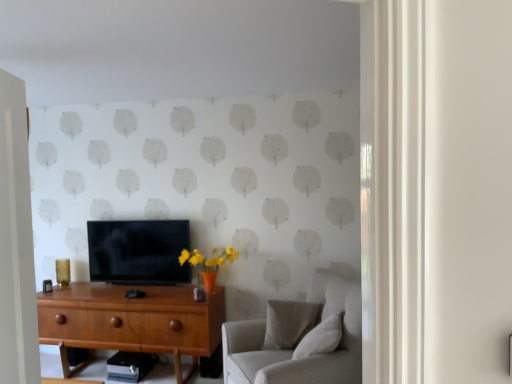
What are the coordinates of `wooden desk at center` in the screenshot? It's located at (133, 322).

I want to click on white textured pillow at lower right, which is the first pillow from front to back, so pyautogui.click(x=321, y=338).

Measure the distance between light gray fabric couch at right and camera.

light gray fabric couch at right and camera are 2.34 meters apart.

The height and width of the screenshot is (384, 512). Describe the element at coordinates (138, 252) in the screenshot. I see `matte black tv at center` at that location.

Describe the element at coordinates (288, 323) in the screenshot. The width and height of the screenshot is (512, 384). I see `light gray fabric pillow at center, positioned as the 1th pillow in back-to-front order` at that location.

Identify the location of wooden desk at center. (133, 322).

From the image's perspective, between white textured pillow at lower right, placed as the second pillow when sorted from back to front, and matte black tv at center, which one is located above?

matte black tv at center.

What's the angular difference between white textured pillow at lower right, placed as the second pillow when sorted from back to front, and matte black tv at center's facing directions?

There is a 99.3-degree angle between the facing directions of white textured pillow at lower right, placed as the second pillow when sorted from back to front, and matte black tv at center.

Based on the photo, is white textured pillow at lower right, which is the first pillow from front to back, bigger than matte black tv at center?

No.

Who is taller, white textured pillow at lower right, placed as the second pillow when sorted from back to front, or matte black tv at center?

matte black tv at center.

Looking at this image, is white textured pillow at lower right, which is the first pillow from front to back, located within matte black tv at center?

Definitely not — white textured pillow at lower right, which is the first pillow from front to back, is not inside matte black tv at center.

Which is in front, matte black tv at center or white textured pillow at lower right, which is the first pillow from front to back?

white textured pillow at lower right, which is the first pillow from front to back, is in front.

Looking at this image, in terms of size, does matte black tv at center appear bigger or smaller than white textured pillow at lower right, which is the first pillow from front to back?

Clearly, matte black tv at center is larger in size than white textured pillow at lower right, which is the first pillow from front to back.

Is matte black tv at center positioned with its back to light gray fabric couch at right?

No, light gray fabric couch at right is not at the back of matte black tv at center.

Is matte black tv at center in front of light gray fabric couch at right?

No, matte black tv at center is further to the viewer.

Can you see matte black tv at center touching light gray fabric couch at right?

There is a gap between matte black tv at center and light gray fabric couch at right.

Looking at this image, between wooden desk at center and white textured pillow at lower right, which is the first pillow from front to back, which one has smaller width?

white textured pillow at lower right, which is the first pillow from front to back.

Considering the sizes of wooden desk at center and white textured pillow at lower right, placed as the second pillow when sorted from back to front, in the image, is wooden desk at center taller or shorter than white textured pillow at lower right, placed as the second pillow when sorted from back to front,?

wooden desk at center is taller than white textured pillow at lower right, placed as the second pillow when sorted from back to front.

Is white textured pillow at lower right, placed as the second pillow when sorted from back to front, located within wooden desk at center?

That's incorrect, white textured pillow at lower right, placed as the second pillow when sorted from back to front, is not inside wooden desk at center.

Which of these two, wooden desk at center or white textured pillow at lower right, which is the first pillow from front to back, is smaller?

white textured pillow at lower right, which is the first pillow from front to back, is smaller.

Based on the photo, which object is more forward, matte black tv at center or light gray fabric pillow at center, arranged as the 2th pillow when viewed from the front?

light gray fabric pillow at center, arranged as the 2th pillow when viewed from the front, is in front.

Is matte black tv at center at the left side of light gray fabric pillow at center, positioned as the 1th pillow in back-to-front order?

Yes.

Does matte black tv at center have a greater height compared to light gray fabric pillow at center, positioned as the 1th pillow in back-to-front order?

Yes, matte black tv at center is taller than light gray fabric pillow at center, positioned as the 1th pillow in back-to-front order.

Does matte black tv at center have a lesser width compared to light gray fabric pillow at center, positioned as the 1th pillow in back-to-front order?

Yes, matte black tv at center is thinner than light gray fabric pillow at center, positioned as the 1th pillow in back-to-front order.

From the image's perspective, is wooden desk at center located above or below light gray fabric couch at right?

wooden desk at center is below light gray fabric couch at right.

The width and height of the screenshot is (512, 384). I want to click on desk below the light gray fabric couch at right (from a real-world perspective), so (133, 322).

Is wooden desk at center smaller than light gray fabric couch at right?

Correct, wooden desk at center occupies less space than light gray fabric couch at right.

Is white textured pillow at lower right, placed as the second pillow when sorted from back to front, inside or outside of light gray fabric pillow at center, arranged as the 2th pillow when viewed from the front?

white textured pillow at lower right, placed as the second pillow when sorted from back to front, cannot be found inside light gray fabric pillow at center, arranged as the 2th pillow when viewed from the front.

Between point (339, 328) and point (294, 326), which one is positioned behind?

Point (294, 326)

Starting from the matte black tv at center, which pillow is the 2nd one to the right? Please provide its 2D coordinates.

[(321, 338)]

Locate an element on the screen. The height and width of the screenshot is (384, 512). television that appears on the left of white textured pillow at lower right, placed as the second pillow when sorted from back to front is located at coordinates (138, 252).

From the picture: Estimate the real-world distances between objects in this image. Which object is closer to matte black tv at center, white textured pillow at lower right, placed as the second pillow when sorted from back to front, or wooden desk at center?

wooden desk at center is positioned closer to the anchor matte black tv at center.

From the image, which object appears to be nearer to light gray fabric pillow at center, positioned as the 1th pillow in back-to-front order, matte black tv at center or wooden desk at center?

The object closer to light gray fabric pillow at center, positioned as the 1th pillow in back-to-front order, is wooden desk at center.

Based on their spatial positions, is wooden desk at center or light gray fabric pillow at center, arranged as the 2th pillow when viewed from the front, closer to light gray fabric couch at right?

light gray fabric pillow at center, arranged as the 2th pillow when viewed from the front, is closer to light gray fabric couch at right.

From the image, which object appears to be farther from white textured pillow at lower right, which is the first pillow from front to back, matte black tv at center or light gray fabric pillow at center, positioned as the 1th pillow in back-to-front order?

matte black tv at center is positioned further to the anchor white textured pillow at lower right, which is the first pillow from front to back.

From the image, which object appears to be farther from white textured pillow at lower right, placed as the second pillow when sorted from back to front, wooden desk at center or light gray fabric couch at right?

wooden desk at center is positioned further to the anchor white textured pillow at lower right, placed as the second pillow when sorted from back to front.

Estimate the real-world distances between objects in this image. Which object is further from matte black tv at center, white textured pillow at lower right, which is the first pillow from front to back, or light gray fabric pillow at center, arranged as the 2th pillow when viewed from the front?

The object further to matte black tv at center is white textured pillow at lower right, which is the first pillow from front to back.

Looking at the image, which one is located further to white textured pillow at lower right, which is the first pillow from front to back, matte black tv at center or light gray fabric couch at right?

matte black tv at center lies further to white textured pillow at lower right, which is the first pillow from front to back, than the other object.

Looking at the image, which one is located further to wooden desk at center, light gray fabric pillow at center, arranged as the 2th pillow when viewed from the front, or white textured pillow at lower right, which is the first pillow from front to back?

white textured pillow at lower right, which is the first pillow from front to back, is positioned further to the anchor wooden desk at center.

You are a GUI agent. You are given a task and a screenshot of the screen. Output one action in this format:
    pyautogui.click(x=<x>, y=<y>)
    Task: Click on the studio couch situated between wooden desk at center and white textured pillow at lower right, which is the first pillow from front to back, from left to right
    The image size is (512, 384).
    Given the screenshot: What is the action you would take?
    point(292,350)

The height and width of the screenshot is (384, 512). Identify the location of pillow between light gray fabric couch at right and light gray fabric pillow at center, arranged as the 2th pillow when viewed from the front, along the z-axis. (321, 338).

Locate an element on the screen. pillow between wooden desk at center and light gray fabric couch at right is located at coordinates (288, 323).

The width and height of the screenshot is (512, 384). Identify the location of pillow situated between matte black tv at center and light gray fabric couch at right from left to right. (288, 323).